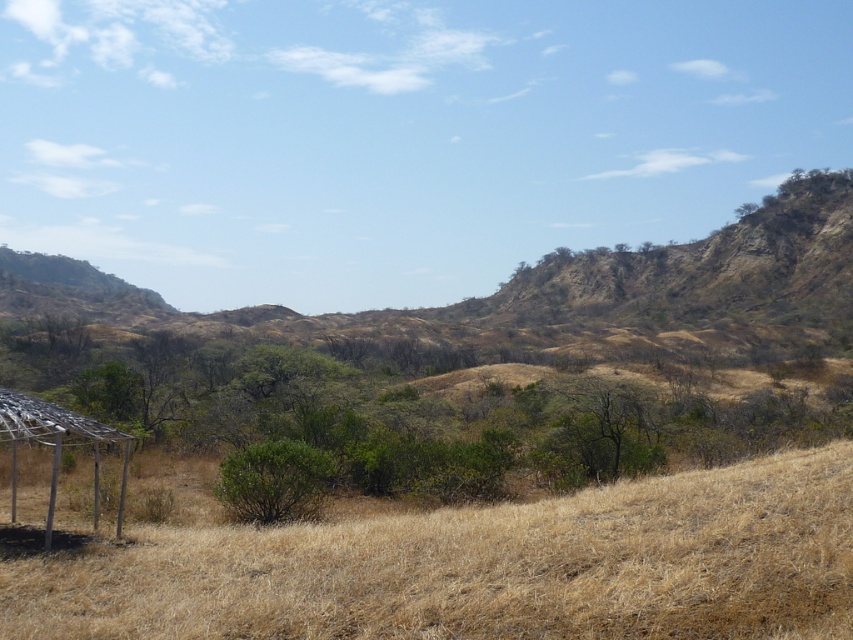
Does dry grass at lower center have a larger size compared to metallic silver gazebo at lower left?

No, dry grass at lower center is not bigger than metallic silver gazebo at lower left.

Can you confirm if dry grass at lower center is smaller than metallic silver gazebo at lower left?

Indeed, dry grass at lower center has a smaller size compared to metallic silver gazebo at lower left.

Measure the distance between dry grass at lower center and camera.

dry grass at lower center and camera are 6.24 meters apart.

Find the location of a particular element. dry grass at lower center is located at coordinates (485, 566).